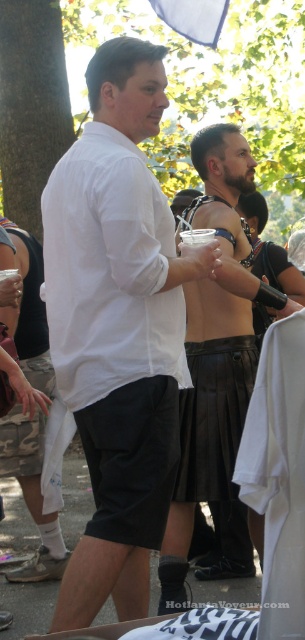
Question: In this image, where is white cotton shirt at center located relative to leather kilt at center?

Choices:
 (A) left
 (B) right

Answer: (A)

Question: Which object is positioned closest to the leather kilt at center?

Choices:
 (A) white matte shirt at center
 (B) white cotton shirt at center

Answer: (A)

Question: Considering the relative positions of white matte shirt at center and leather kilt at center in the image provided, where is white matte shirt at center located with respect to leather kilt at center?

Choices:
 (A) left
 (B) right

Answer: (A)

Question: Estimate the real-world distances between objects in this image. Which object is farther from the leather kilt at center?

Choices:
 (A) white cotton shirt at center
 (B) white matte shirt at center

Answer: (A)

Question: Does white matte shirt at center have a smaller size compared to leather kilt at center?

Choices:
 (A) yes
 (B) no

Answer: (A)

Question: Among these objects, which one is farthest from the camera?

Choices:
 (A) white cotton shirt at center
 (B) leather kilt at center

Answer: (B)